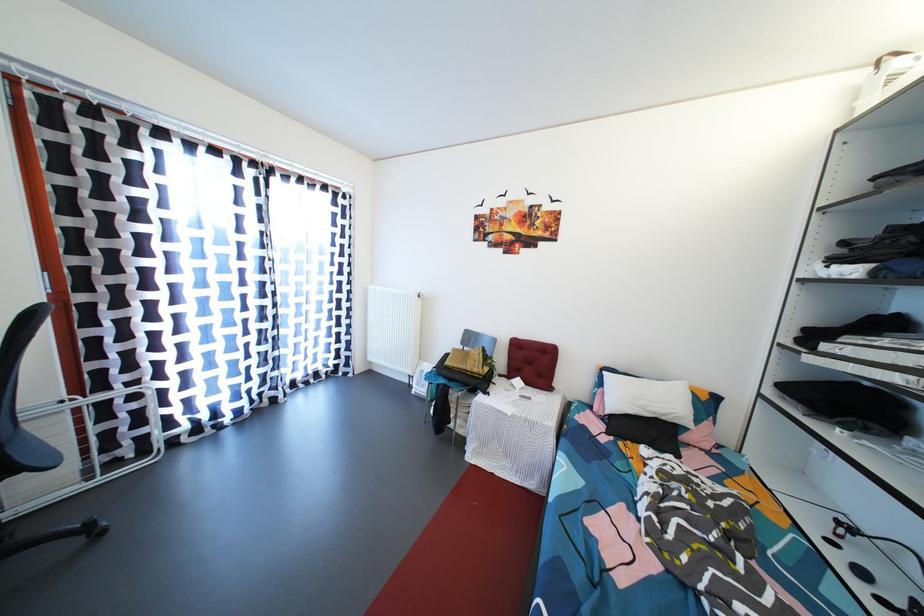
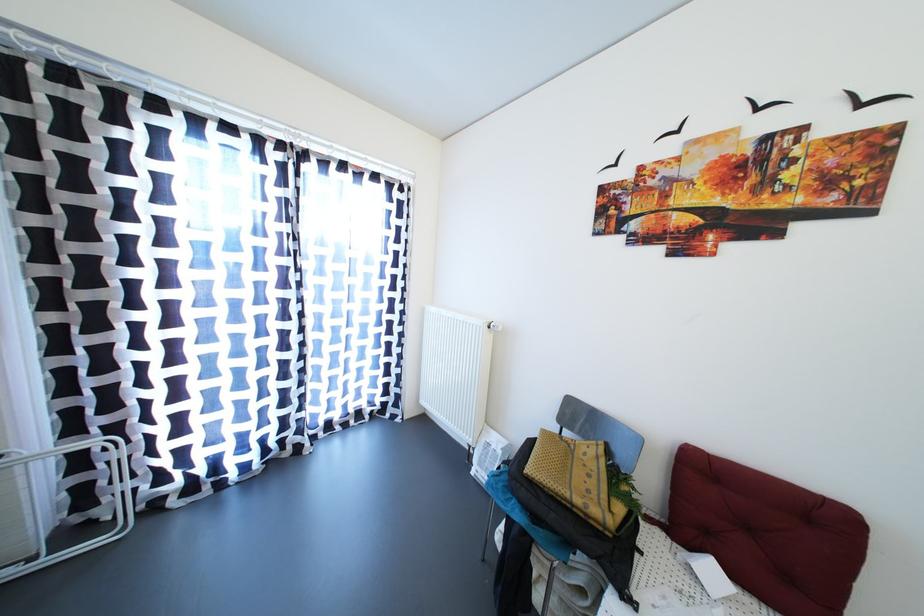
The point at (377, 363) is marked in the first image. Where is the corresponding point in the second image?

(430, 407)